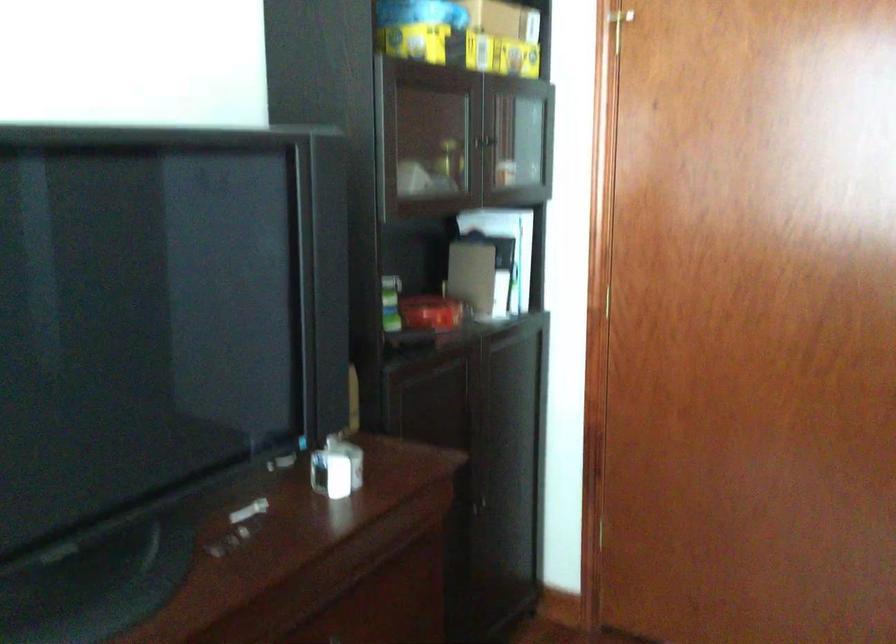
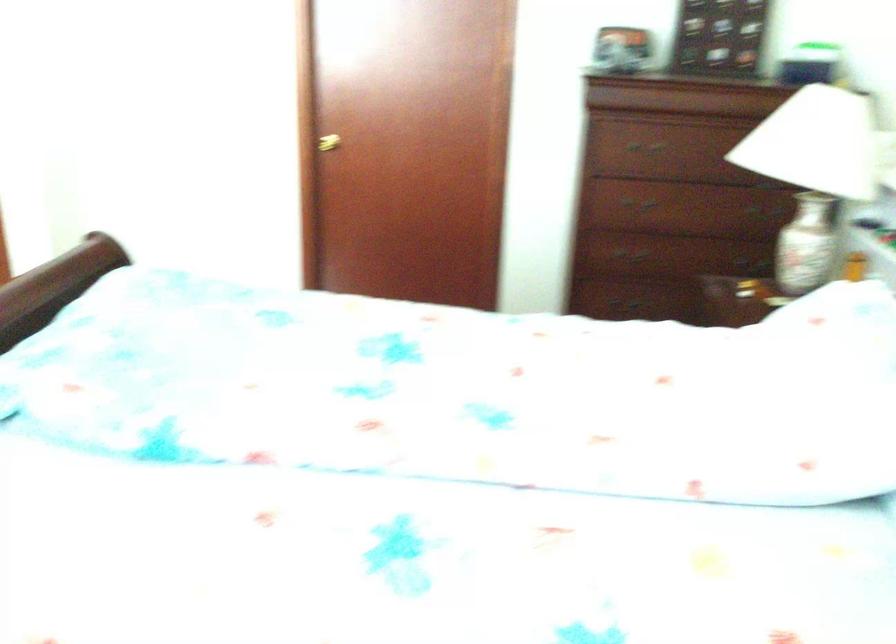
The images are taken continuously from a first-person perspective. In which direction are you moving?

The movement direction of the cameraman is right, backward.